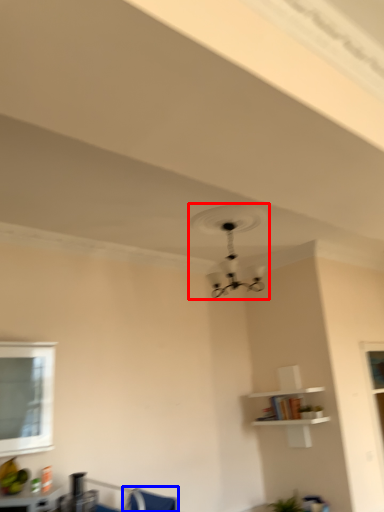
Question: Which point is further to the camera, fan (highlighted by a red box) or swivel chair (highlighted by a blue box)?

Choices:
 (A) fan
 (B) swivel chair

Answer: (A)